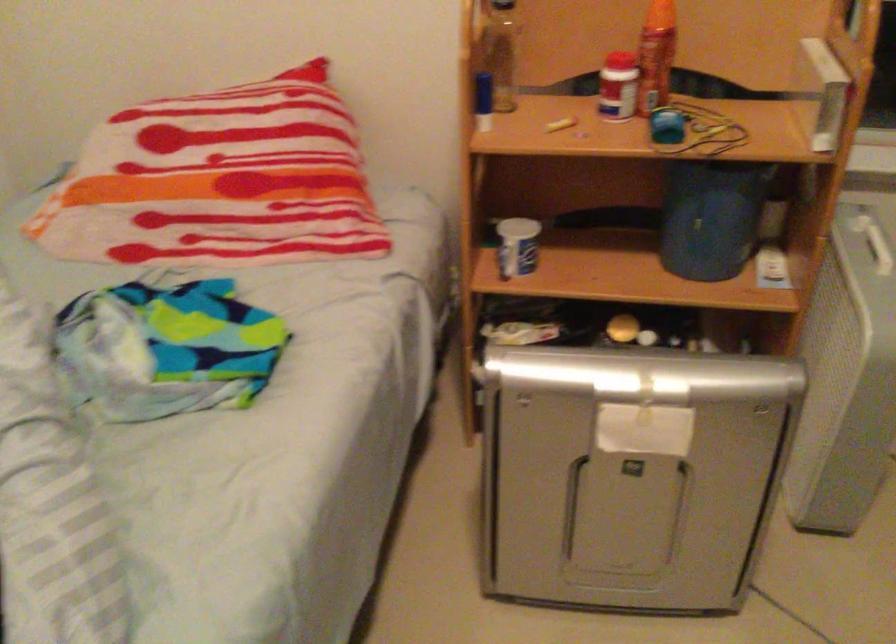
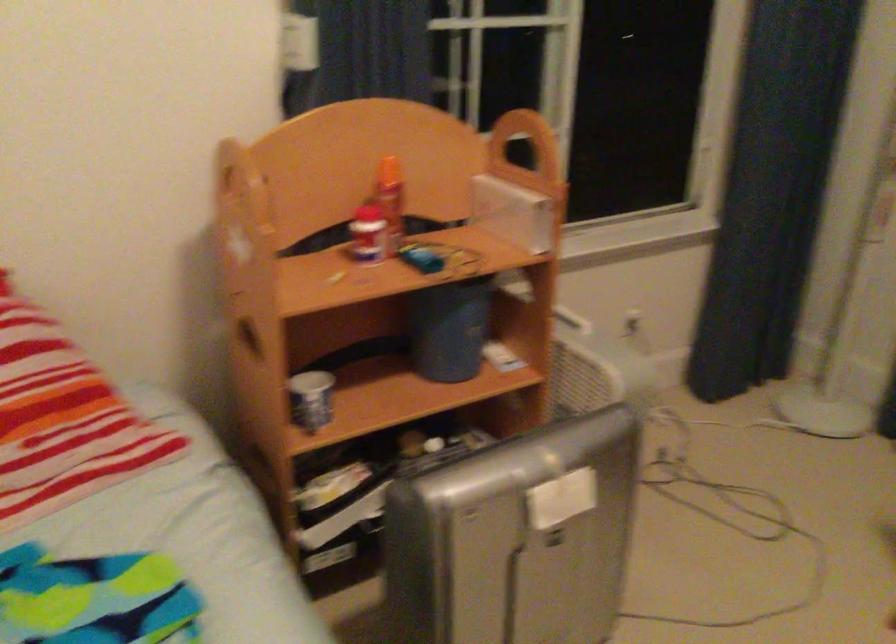
Where in the second image is the point corresponding to the point at 612,86 from the first image?

(367, 234)